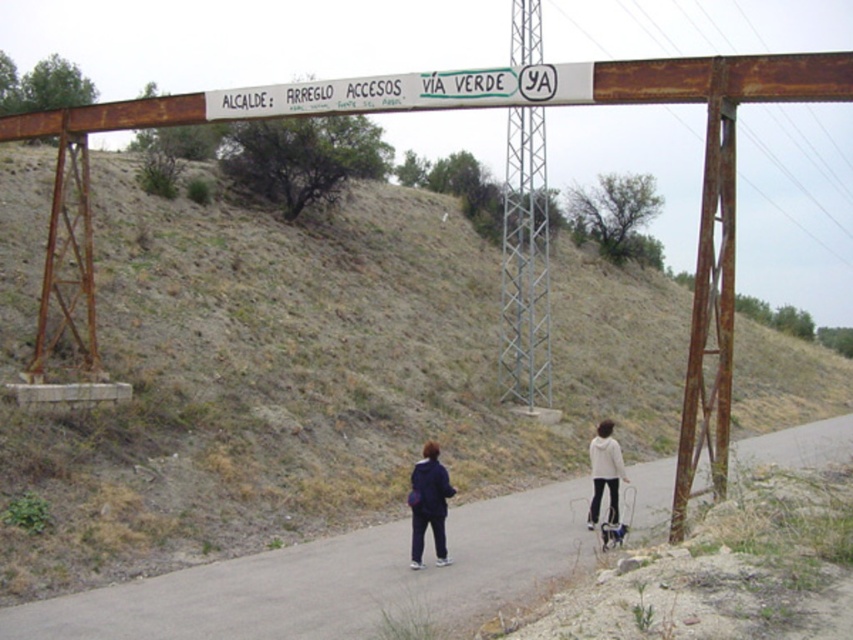
You are a hiker standing at the starting point of the pathway. You see two points marked on the path ahead of you. The first point is at coordinates point (354, 484) and the second point is at point (309, 109). Which point will you encounter first as you walk along the pathway?

Point (354, 484) is further to the viewer than point (309, 109), so you will encounter point (354, 484) first as you walk along the pathway.

You are a hiker who wants to take a photo of the matte blue jacket at center without including the asphalt road at center in the frame. Which direction should you move your camera to achieve this?

The asphalt road at center is below the matte blue jacket at center. To exclude the asphalt road at center from the frame, move the camera upward so that the matte blue jacket at center remains in view while the asphalt road at center is no longer visible.